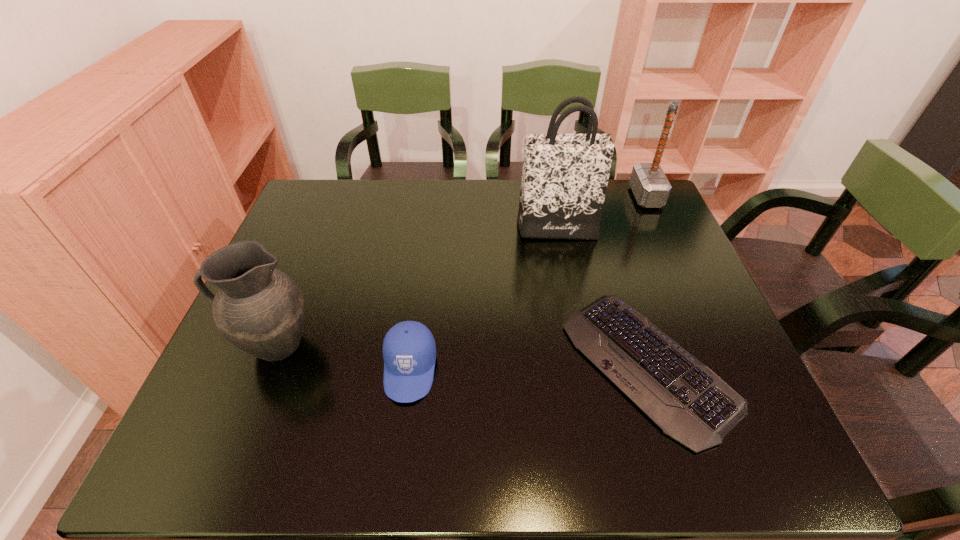
The height and width of the screenshot is (540, 960). Identify the location of shopping bag. pyautogui.click(x=564, y=180).

Where is `the second farthest object`? the second farthest object is located at coordinates (564, 180).

You are a GUI agent. You are given a task and a screenshot of the screen. Output one action in this format:
    pyautogui.click(x=<x>, y=<y>)
    Task: Click on the hammer
    The image size is (960, 540).
    Given the screenshot: What is the action you would take?
    pyautogui.click(x=650, y=186)

Find the location of a particular element. This screenshot has width=960, height=540. pitcher is located at coordinates (259, 309).

Locate an element on the screen. This screenshot has height=540, width=960. the second object from left to right is located at coordinates (409, 351).

Where is `cap`? This screenshot has width=960, height=540. cap is located at coordinates (409, 351).

Image resolution: width=960 pixels, height=540 pixels. I want to click on the shortest object, so click(x=690, y=403).

This screenshot has width=960, height=540. I want to click on vacant area situated 0.340m on the front of the shopping bag with the design, so click(x=577, y=335).

Where is `vacant area located 0.190m on the striking surface of the hammer`? This screenshot has width=960, height=540. vacant area located 0.190m on the striking surface of the hammer is located at coordinates (573, 197).

I want to click on vacant area located 0.160m on the striking surface of the hammer, so click(583, 197).